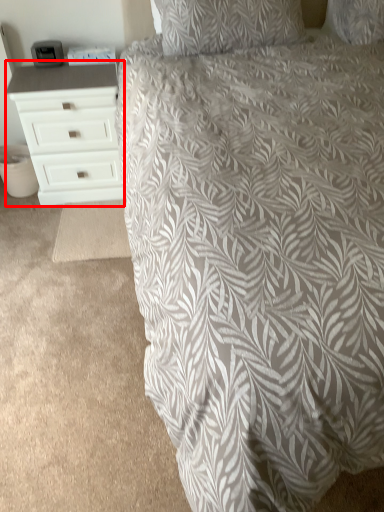
Question: From the image's perspective, where is chest of drawers (annotated by the red box) located in relation to bed in the image?

Choices:
 (A) below
 (B) above

Answer: (B)